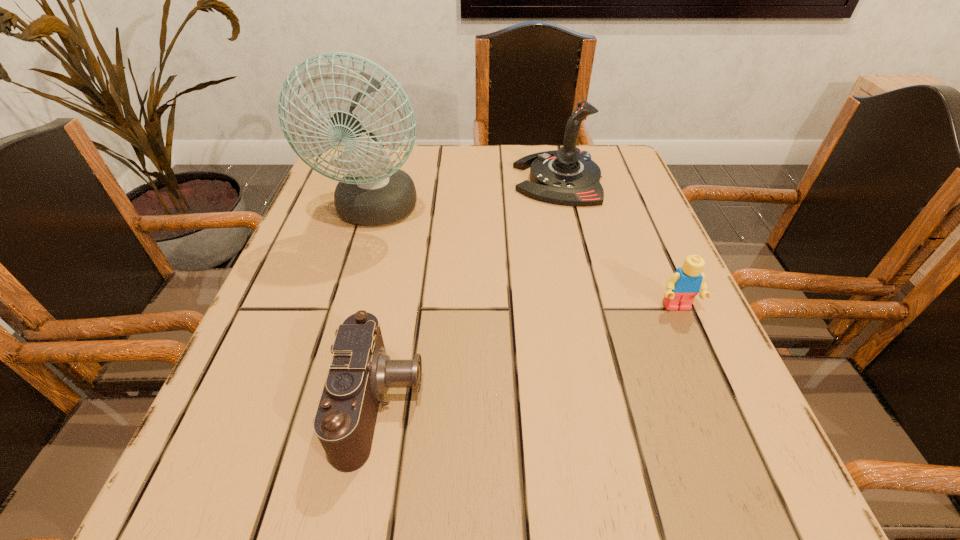
Find the location of a particular element. The image size is (960, 540). vacant space at the far edge is located at coordinates (499, 182).

The image size is (960, 540). Identify the location of vacant space at the near edge of the desktop. (532, 475).

The image size is (960, 540). Find the location of `free space at the left edge of the desktop`. free space at the left edge of the desktop is located at coordinates (330, 253).

Identify the location of free space at the right edge of the desktop. The height and width of the screenshot is (540, 960). (622, 230).

Locate an element on the screen. This screenshot has width=960, height=540. vacant space at the far left corner of the desktop is located at coordinates (332, 185).

The width and height of the screenshot is (960, 540). What are the coordinates of `vacant space at the near left corner` in the screenshot? It's located at (281, 477).

Find the location of a particular element. The image size is (960, 540). free location at the far right corner of the desktop is located at coordinates [612, 152].

Image resolution: width=960 pixels, height=540 pixels. In order to click on vacant region between the second object from right to left and the tallest object in this screenshot , I will do `click(467, 195)`.

Identify the location of unoccupied area between the second tallest object and the tallest object. The height and width of the screenshot is (540, 960). (467, 195).

Image resolution: width=960 pixels, height=540 pixels. Identify the location of free area in between the fan and the second tallest object. (467, 195).